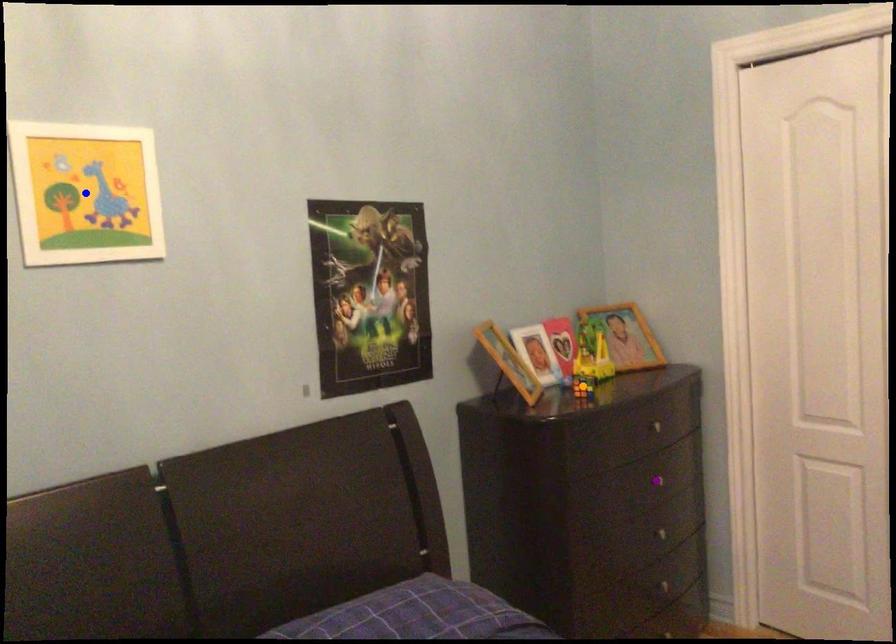
Looking at this image, order these from nearest to farthest:
blue point
purple point
orange point

blue point, orange point, purple point